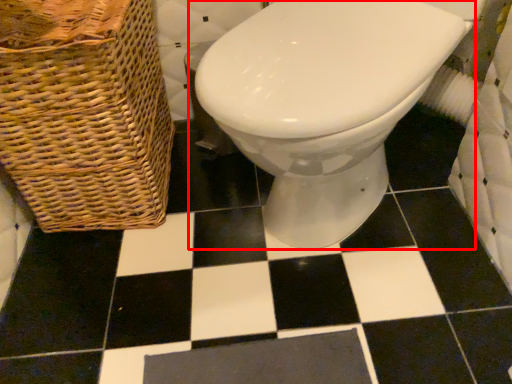
Question: From the image, what is the correct spatial relationship of toilet (annotated by the red box) in relation to basket?

Choices:
 (A) right
 (B) left

Answer: (A)